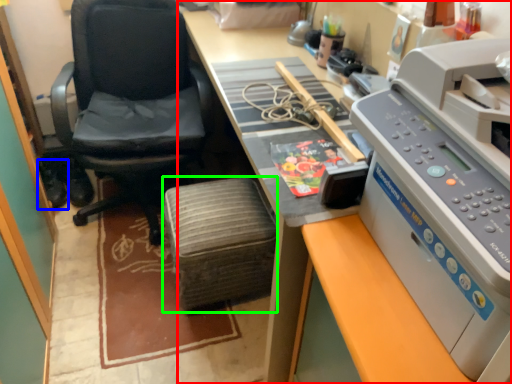
Question: Which is farther away from desk (highlighted by a red box)? footwear (highlighted by a blue box) or stool (highlighted by a green box)?

Choices:
 (A) footwear
 (B) stool

Answer: (A)